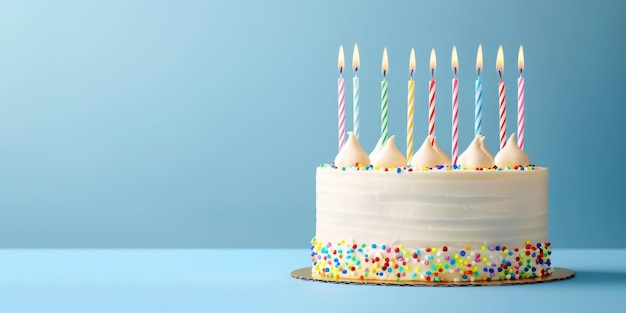
Find the location of `birthday candle flames`. birthday candle flames is located at coordinates (339, 63), (356, 64), (384, 66), (411, 63), (433, 59), (456, 60), (478, 61), (501, 67), (520, 60).